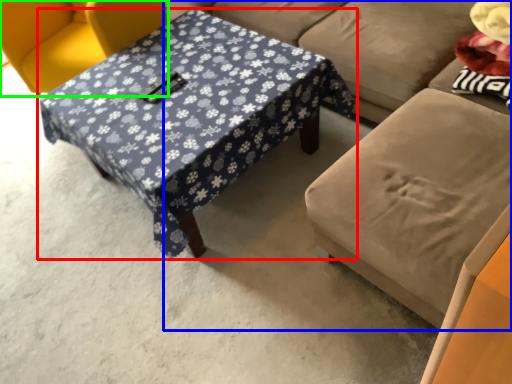
Question: Which is farther away from table (highlighted by a red box)? studio couch (highlighted by a blue box) or chair (highlighted by a green box)?

Choices:
 (A) studio couch
 (B) chair

Answer: (B)